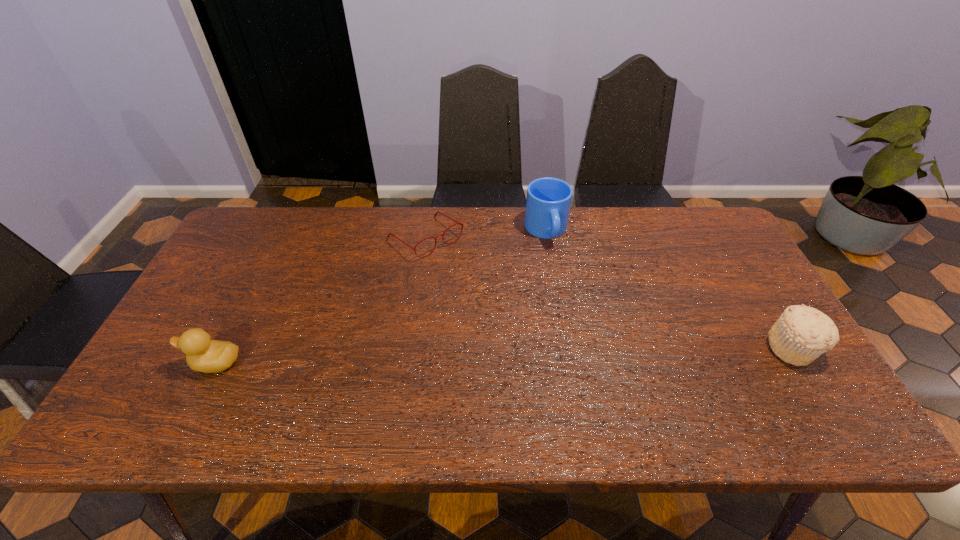
You are a GUI agent. You are given a task and a screenshot of the screen. Output one action in this format:
    pyautogui.click(x=<x>, y=<y>)
    Task: Click on the free spot between the second object from right to left and the leftmost object
    Image resolution: width=960 pixels, height=540 pixels.
    Given the screenshot: What is the action you would take?
    (x=380, y=297)

Locate an element on the screen. free space between the leftmost object and the spectacles is located at coordinates (321, 300).

Image resolution: width=960 pixels, height=540 pixels. What are the coordinates of `vacant space in between the rightmost object and the second object from left to right` in the screenshot? It's located at (609, 293).

What are the coordinates of `free space between the mug and the shortest object` in the screenshot? It's located at (486, 234).

Where is `empty location between the leftmost object and the mug`? empty location between the leftmost object and the mug is located at coordinates 380,297.

This screenshot has width=960, height=540. Identify the location of vacant area that lies between the mug and the leftmost object. tap(380, 297).

At what (x,y) coordinates should I click in order to perform the action: click on empty space between the third object from right to left and the duckling. Please return your answer as a coordinate pair (x, y). Looking at the image, I should click on (321, 300).

You are a GUI agent. You are given a task and a screenshot of the screen. Output one action in this format:
    pyautogui.click(x=<x>, y=<y>)
    Task: Click on the object that can be found as the second closest to the leftmost object
    Image resolution: width=960 pixels, height=540 pixels.
    Given the screenshot: What is the action you would take?
    pyautogui.click(x=548, y=201)

Locate which object is the third closest to the second object from left to right. Please provide its 2D coordinates. Your answer should be formatted as a tuple, i.e. [(x, y)], where the tuple contains the x and y coordinates of a point satisfying the conditions above.

[(802, 333)]

This screenshot has width=960, height=540. Identify the location of free space that satisfies the following two spatial constraints: 1. on the back side of the shortest object; 2. on the right side of the mug. (426, 231).